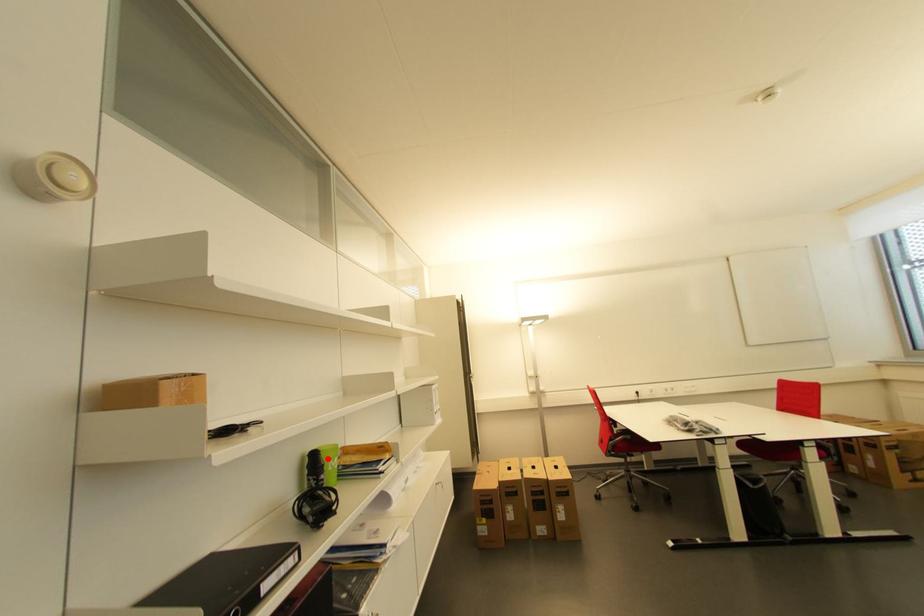
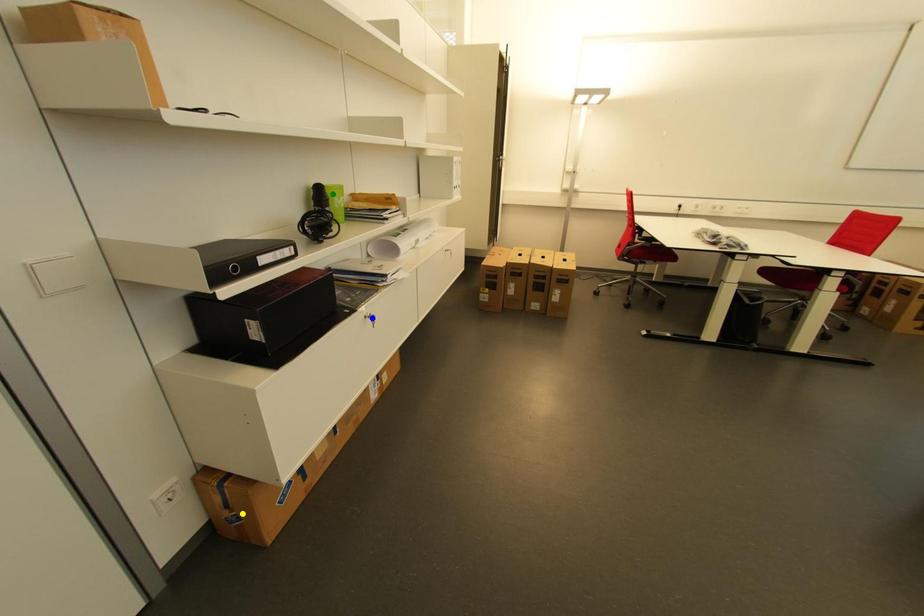
Question: I am providing you with two images of the same scene from different viewpoints. A red point is marked on the first image. You are given multiple points on the second image. Which mark in image 2 goes with the point in image 1?

Choices:
 (A) yellow point
 (B) blue point
 (C) green point

Answer: (C)